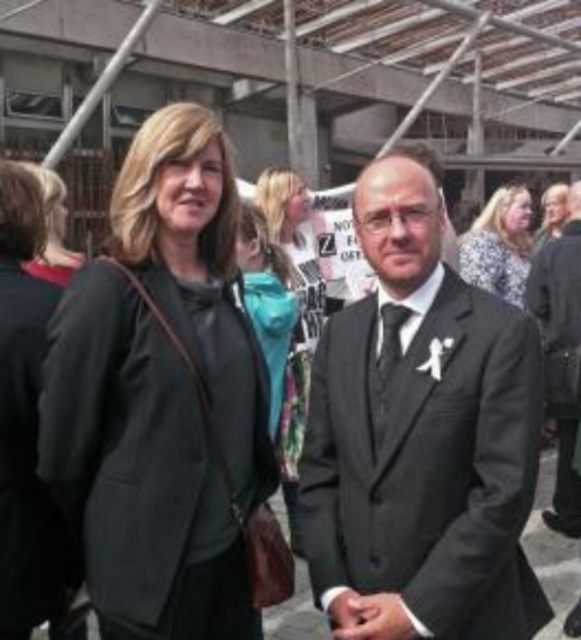
You are a photographer at the event and want to focus on the floral pattern on the dress. The point you need to focus on is at coordinate point (500, 244). Which object in the scene corresponds to this coordinate?

The point (500, 244) is on the floral patterned dress at upper right.